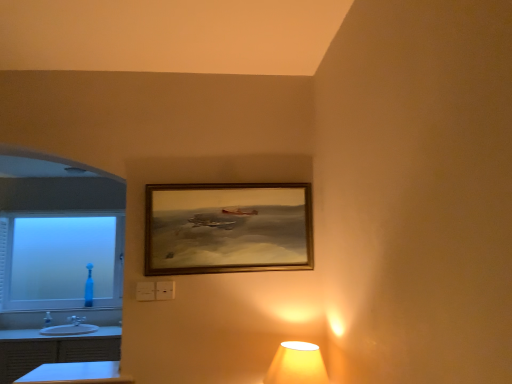
Question: Looking at their shapes, would you say white glossy dresser at lower left is wider or thinner than blue glass bottle at lower left?

Choices:
 (A) thin
 (B) wide

Answer: (B)

Question: Would you say white glossy dresser at lower left is to the left or to the right of blue glass bottle at lower left in the picture?

Choices:
 (A) right
 (B) left

Answer: (A)

Question: Which object is the farthest from the wooden frame at center?

Choices:
 (A) blue glossy table at lower left
 (B) matte yellow lampshade at lower right
 (C) frosted glass window at left
 (D) white glossy sink at lower left
 (E) white glossy dresser at lower left

Answer: (C)

Question: Which object is the closest to the white glossy dresser at lower left?

Choices:
 (A) wooden frame at center
 (B) matte yellow lampshade at lower right
 (C) blue glossy table at lower left
 (D) blue glass bottle at lower left
 (E) white glossy sink at lower left

Answer: (E)